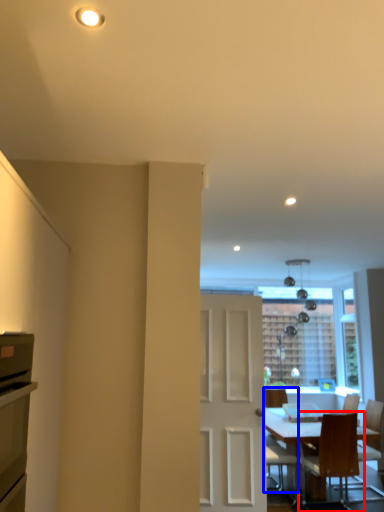
Question: Which object is closer to the camera taking this photo, chair (highlighted by a red box) or chair (highlighted by a blue box)?

Choices:
 (A) chair
 (B) chair

Answer: (A)